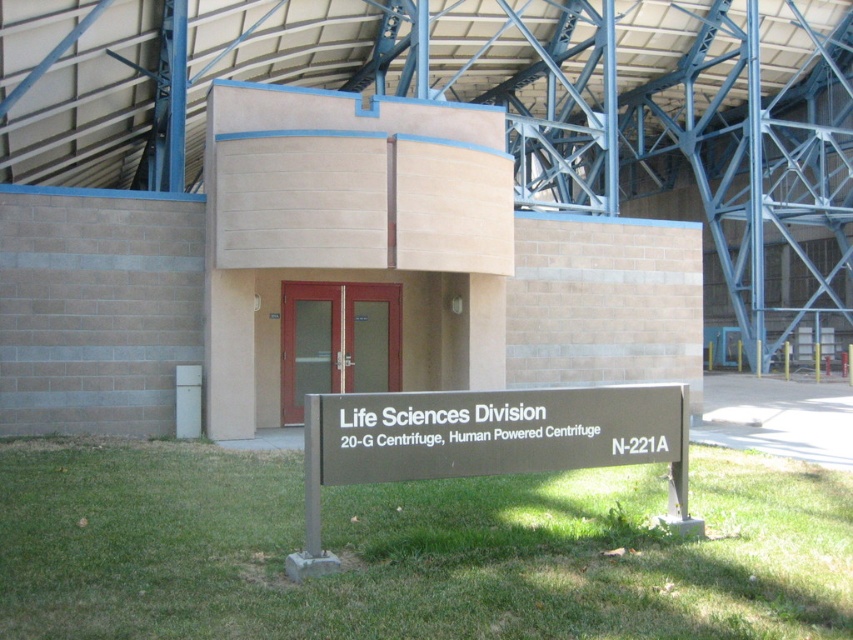
From the picture: Does green grass at lower center appear on the left side of brown metal sign at center?

Indeed, green grass at lower center is positioned on the left side of brown metal sign at center.

Is green grass at lower center taller than brown metal sign at center?

In fact, green grass at lower center may be shorter than brown metal sign at center.

Who is more forward, (688, 557) or (340, 470)?

Point (340, 470)

Find the location of a particular element. This screenshot has width=853, height=640. green grass at lower center is located at coordinates (413, 548).